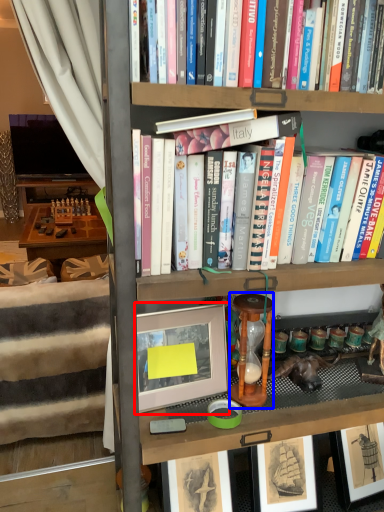
Question: Which object is closer to the camera taking this photo, picture frame (highlighted by a red box) or stool (highlighted by a blue box)?

Choices:
 (A) picture frame
 (B) stool

Answer: (A)